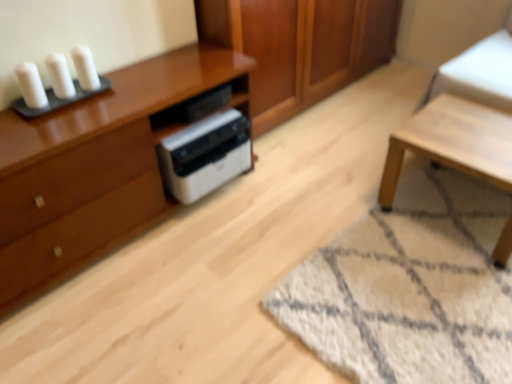
Question: Considering the relative sizes of white plastic printer at center and white plastic printer at center in the image provided, is white plastic printer at center bigger than white plastic printer at center?

Choices:
 (A) yes
 (B) no

Answer: (B)

Question: From the image's perspective, is white plastic printer at center located above white plastic printer at center?

Choices:
 (A) yes
 (B) no

Answer: (A)

Question: Is the depth of white plastic printer at center less than that of white plastic printer at center?

Choices:
 (A) no
 (B) yes

Answer: (A)

Question: Is white plastic printer at center far from white plastic printer at center?

Choices:
 (A) yes
 (B) no

Answer: (B)

Question: Is white plastic printer at center facing away from white plastic printer at center?

Choices:
 (A) yes
 (B) no

Answer: (B)

Question: Is white plastic printer at center shorter than white plastic printer at center?

Choices:
 (A) no
 (B) yes

Answer: (B)

Question: Is white shaggy rug at lower right smaller than matte brown cabinet at left?

Choices:
 (A) no
 (B) yes

Answer: (B)

Question: From the image's perspective, does white shaggy rug at lower right appear higher than matte brown cabinet at left?

Choices:
 (A) no
 (B) yes

Answer: (A)

Question: Considering the relative sizes of white shaggy rug at lower right and matte brown cabinet at left in the image provided, is white shaggy rug at lower right taller than matte brown cabinet at left?

Choices:
 (A) no
 (B) yes

Answer: (A)

Question: Is the depth of white shaggy rug at lower right greater than that of matte brown cabinet at left?

Choices:
 (A) yes
 (B) no

Answer: (B)

Question: From the image's perspective, is white shaggy rug at lower right below matte brown cabinet at left?

Choices:
 (A) no
 (B) yes

Answer: (B)

Question: Is white shaggy rug at lower right wider than matte brown cabinet at left?

Choices:
 (A) yes
 (B) no

Answer: (A)

Question: From the image's perspective, is wooden cabinet at center below white plastic printer at center?

Choices:
 (A) no
 (B) yes

Answer: (A)